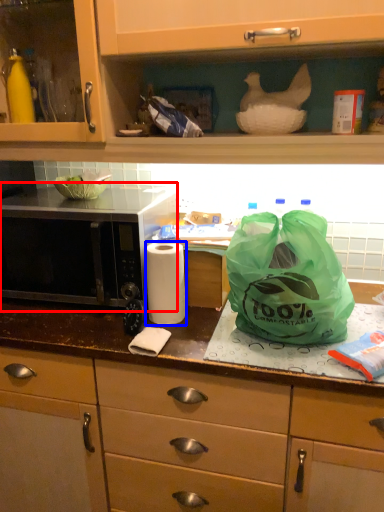
Question: Which point is closer to the camera, microwave (highlighted by a red box) or paper towel (highlighted by a blue box)?

Choices:
 (A) microwave
 (B) paper towel

Answer: (B)